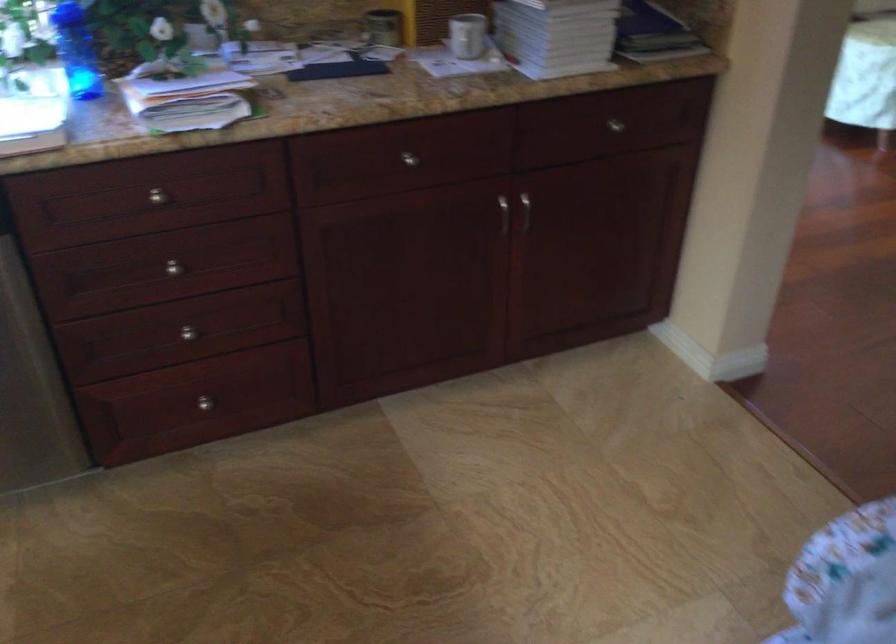
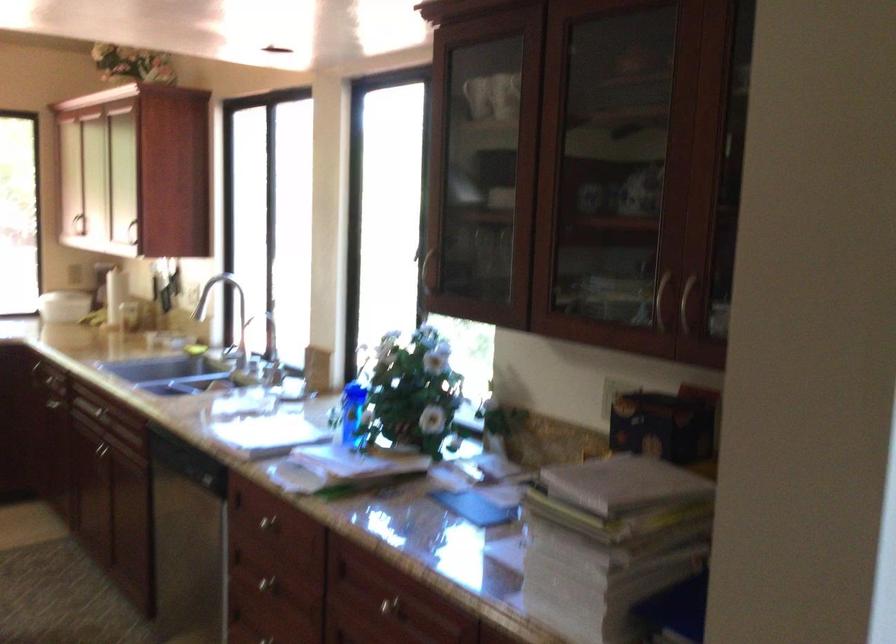
The point at [399,162] is marked in the first image. Where is the corresponding point in the second image?

(386, 605)